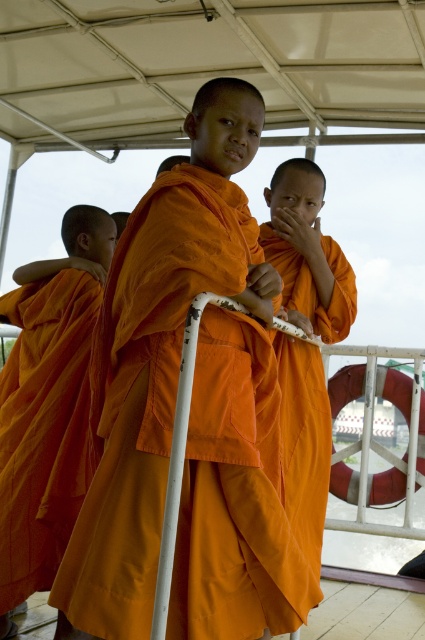
Does point (184, 212) come closer to viewer compared to point (0, 611)?

Yes, it is.

Between orange cloth robe at center and orange cloth at center, which one is positioned lower?

orange cloth at center is lower down.

I want to click on orange cloth robe at center, so (x=146, y=388).

I want to click on orange cloth robe at center, so click(146, 388).

Describe the element at coordinates (44, 428) in the screenshot. I see `orange cloth at center` at that location.

Is orange cloth at center taller than orange clothed monk at center?

In fact, orange cloth at center may be shorter than orange clothed monk at center.

The image size is (425, 640). In order to click on orange cloth at center in this screenshot , I will do `click(44, 428)`.

Which is more to the left, orange cloth robe at center or orange clothed monk at center?

orange cloth robe at center is more to the left.

Is point (209, 356) positioned in front of point (272, 182)?

Yes, it is.

Describe the element at coordinates (146, 388) in the screenshot. The height and width of the screenshot is (640, 425). I see `orange cloth robe at center` at that location.

Find the location of `orange cloth robe at center`. orange cloth robe at center is located at coordinates (146, 388).